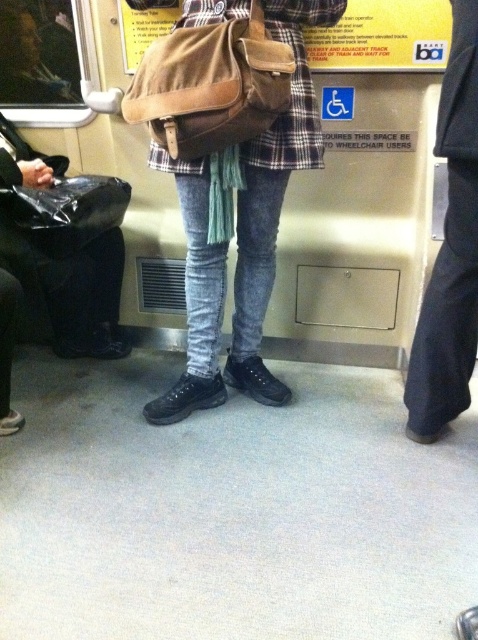
Question: Among these objects, which one is farthest from the camera?

Choices:
 (A) matte brown bag at center
 (B) dark blue fabric at right
 (C) matte black trash can at left

Answer: (C)

Question: Which of the following is the farthest from the observer?

Choices:
 (A) (x=85, y=237)
 (B) (x=254, y=240)
 (C) (x=23, y=182)
 (D) (x=440, y=333)

Answer: (B)

Question: Which object is positioned closest to the dark blue fabric at right?

Choices:
 (A) black plastic bag at left
 (B) matte brown bag at center
 (C) matte black trash can at left

Answer: (B)

Question: Can you confirm if matte black trash can at left is thinner than dark blue fabric at right?

Choices:
 (A) yes
 (B) no

Answer: (B)

Question: Is matte brown bag at center closer to camera compared to brown suede bag at center?

Choices:
 (A) no
 (B) yes

Answer: (A)

Question: Does matte brown bag at center appear over dark blue fabric at right?

Choices:
 (A) yes
 (B) no

Answer: (A)